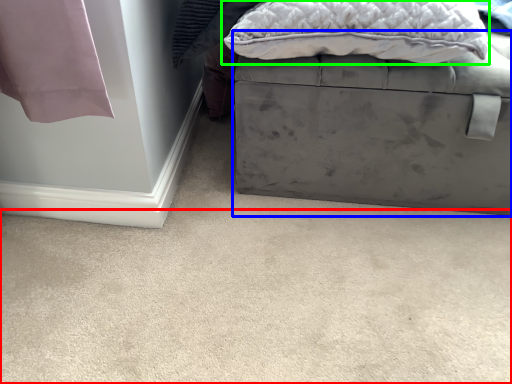
Question: Estimate the real-world distances between objects in this image. Which object is closer to concrete (highlighted by a red box), furniture (highlighted by a blue box) or pillow (highlighted by a green box)?

Choices:
 (A) furniture
 (B) pillow

Answer: (A)